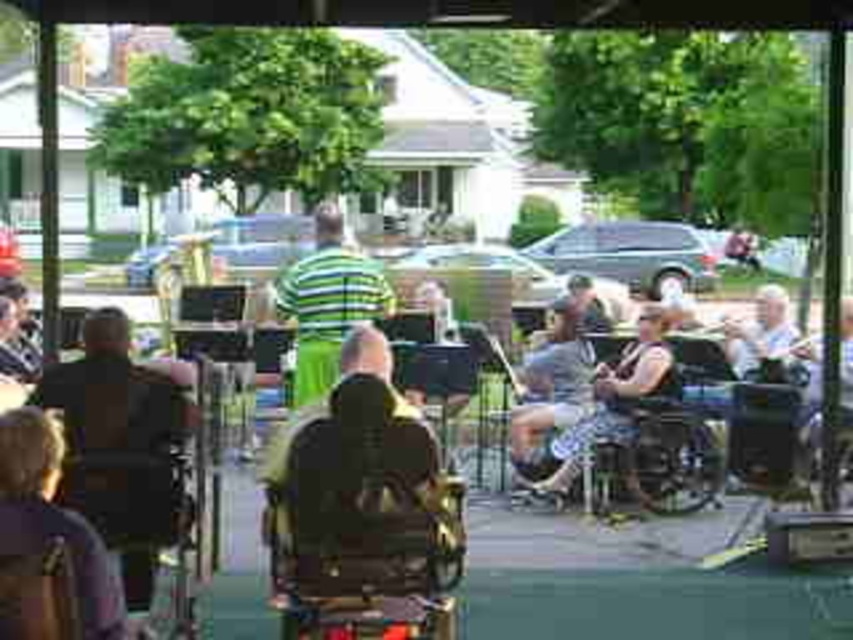
You are standing at the entrance of the pavilion and want to go to the stage area. There are two points marked on the floor. One is at point (35,426) and the other is at point (560,413). Which point should you walk towards to reach the stage area?

Point (560,413) is behind point (35,426), so you should walk towards point (560,413) to reach the stage area because it is closer to the stage.

You are standing in the pavilion and want to pick up the dark brown leather jacket at lower left and the camouflage shorts at center. Which item is closer to your current position?

The dark brown leather jacket at lower left is closer to your current position because it is to the left of camouflage shorts at center.